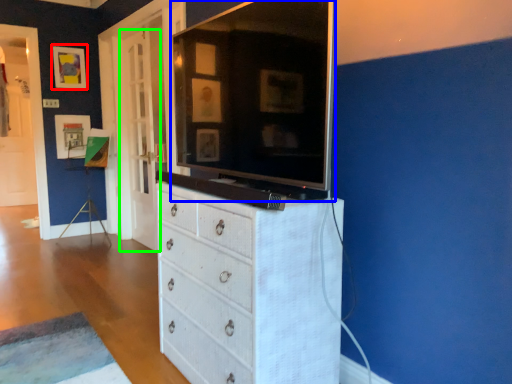
Question: Which is farther away from picture frame (highlighted by a red box)? tv cabinet (highlighted by a blue box) or door (highlighted by a green box)?

Choices:
 (A) tv cabinet
 (B) door

Answer: (A)